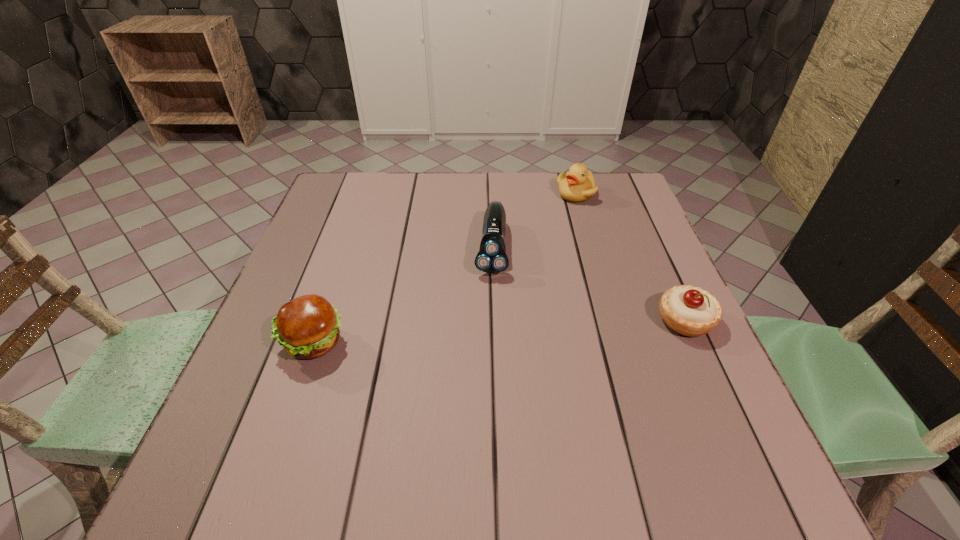
Image resolution: width=960 pixels, height=540 pixels. Identify the location of vacant space positioned on the head of the electric shaver. (486, 348).

This screenshot has height=540, width=960. In order to click on free space located on the beak of the farthest object in this screenshot , I will do `click(560, 293)`.

At what (x,y) coordinates should I click in order to perform the action: click on vacant position located on the beak of the farthest object. Please return your answer as a coordinate pair (x, y). Looking at the image, I should click on (563, 278).

The height and width of the screenshot is (540, 960). I want to click on free location located 0.220m on the beak of the farthest object, so click(566, 252).

Locate an element on the screen. This screenshot has width=960, height=540. object present at the far edge is located at coordinates (578, 184).

Where is `object located at the left edge`? This screenshot has height=540, width=960. object located at the left edge is located at coordinates (307, 327).

I want to click on pastry that is at the right edge, so click(690, 311).

At what (x,y) coordinates should I click in order to perform the action: click on duckling that is at the right edge. Please return your answer as a coordinate pair (x, y). This screenshot has width=960, height=540. Looking at the image, I should click on coord(578,184).

You are a GUI agent. You are given a task and a screenshot of the screen. Output one action in this format:
    pyautogui.click(x=<x>, y=<y>)
    Task: Click on the object present at the far right corner
    
    Given the screenshot: What is the action you would take?
    pyautogui.click(x=578, y=184)

Where is `vacant space at the far edge of the desktop`? vacant space at the far edge of the desktop is located at coordinates (468, 181).